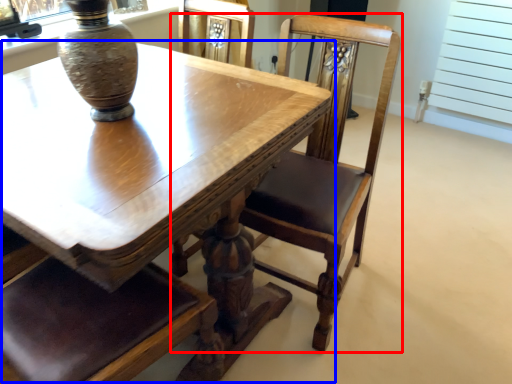
Question: Which object is further to the camera taking this photo, chair (highlighted by a red box) or table (highlighted by a blue box)?

Choices:
 (A) chair
 (B) table

Answer: (A)